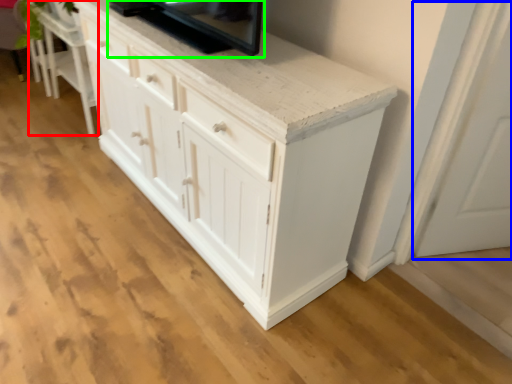
Question: Considering the real-world distances, which object is farthest from vanity (highlighted by a red box)? glass door (highlighted by a blue box) or appliance (highlighted by a green box)?

Choices:
 (A) glass door
 (B) appliance

Answer: (A)